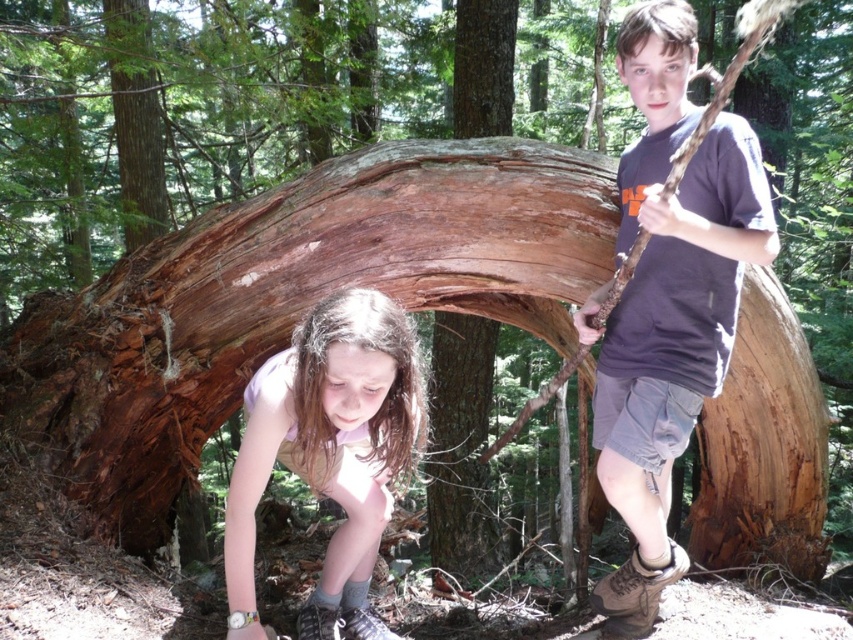
Question: Does matte brown stick at right come behind light pink fabric shirt at lower center?

Choices:
 (A) no
 (B) yes

Answer: (B)

Question: Which point is closer to the camera?

Choices:
 (A) matte brown stick at right
 (B) light pink fabric shirt at lower center

Answer: (B)

Question: Which of the following is the farthest from the observer?

Choices:
 (A) (593, 605)
 (B) (386, 364)

Answer: (A)

Question: Is matte brown stick at right to the right of light pink fabric shirt at lower center from the viewer's perspective?

Choices:
 (A) no
 (B) yes

Answer: (B)

Question: From the image, what is the correct spatial relationship of matte brown stick at right in relation to light pink fabric shirt at lower center?

Choices:
 (A) above
 (B) below

Answer: (A)

Question: Which point appears closest to the camera in this image?

Choices:
 (A) (662, 547)
 (B) (378, 509)

Answer: (B)